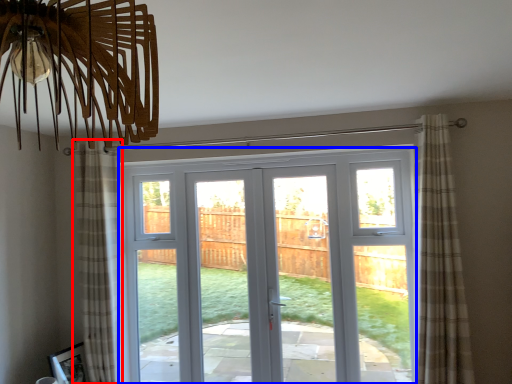
Question: Which point is closer to the camera, curtain (highlighted by a red box) or door (highlighted by a blue box)?

Choices:
 (A) curtain
 (B) door

Answer: (A)